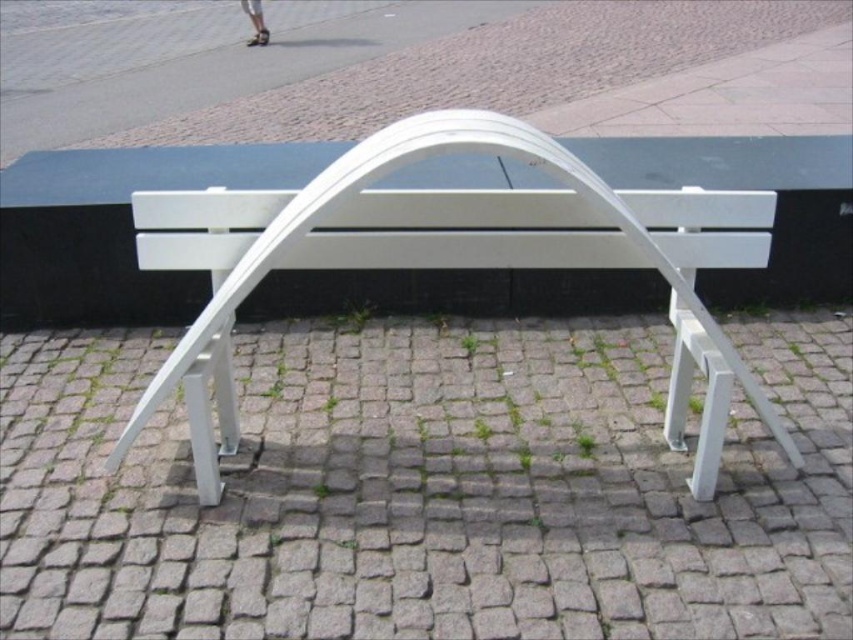
Question: Which point is closer to the camera?

Choices:
 (A) gray cobblestone pavement at center
 (B) white matte bench at center

Answer: (B)

Question: Does gray cobblestone pavement at center have a lesser width compared to white matte bench at center?

Choices:
 (A) no
 (B) yes

Answer: (A)

Question: Where is gray cobblestone pavement at center located in relation to white matte bench at center in the image?

Choices:
 (A) below
 (B) above

Answer: (A)

Question: Does gray cobblestone pavement at center appear under white matte bench at center?

Choices:
 (A) no
 (B) yes

Answer: (B)